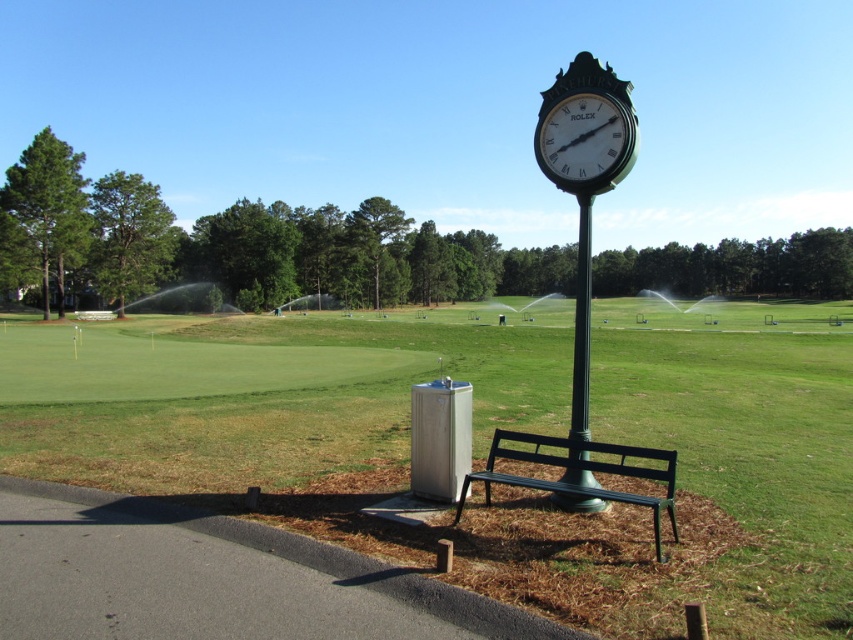
Question: From the image, what is the correct spatial relationship of green grass at center in relation to green painted metal bench at center?

Choices:
 (A) above
 (B) below

Answer: (A)

Question: Based on their relative distances, which object is nearer to the green polished metal pole at center?

Choices:
 (A) black metal clock at upper right
 (B) green painted metal bench at center

Answer: (A)

Question: Which point is closer to the camera taking this photo?

Choices:
 (A) (583, 138)
 (B) (585, 211)
 (C) (674, 467)

Answer: (C)

Question: Does black metal clock at upper right appear on the right side of green polished metal pole at center?

Choices:
 (A) yes
 (B) no

Answer: (B)

Question: Does green painted metal bench at center have a larger size compared to black metal clock at upper right?

Choices:
 (A) no
 (B) yes

Answer: (B)

Question: Among these objects, which one is farthest from the camera?

Choices:
 (A) black metal clock at upper right
 (B) green painted metal bench at center

Answer: (A)